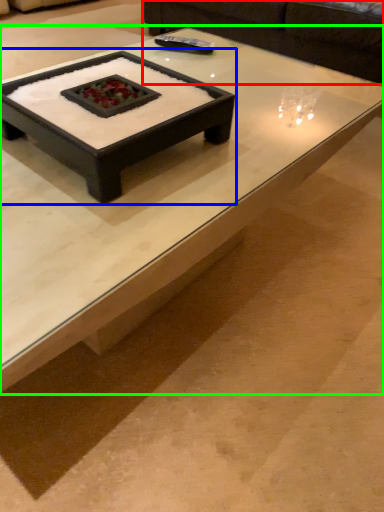
Question: Based on their relative distances, which object is nearer to couch (highlighted by a red box)? Choose from coffee table (highlighted by a blue box) and coffee table (highlighted by a green box).

Choices:
 (A) coffee table
 (B) coffee table

Answer: (B)